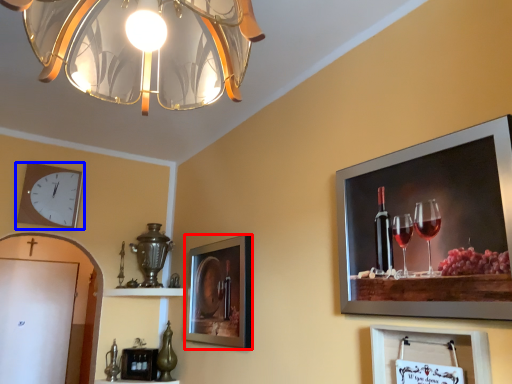
Question: Which object is further to the camera taking this photo, picture frame (highlighted by a red box) or wall clock (highlighted by a blue box)?

Choices:
 (A) picture frame
 (B) wall clock

Answer: (B)